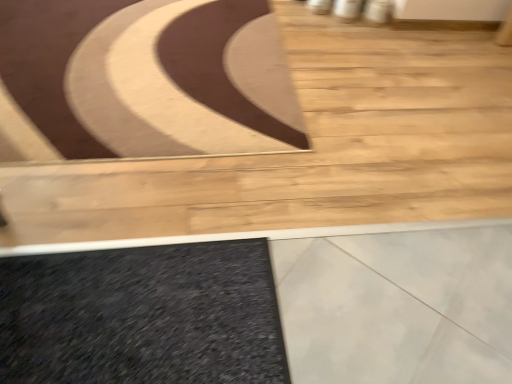
This screenshot has width=512, height=384. Find the location of `granite stairs at center`. granite stairs at center is located at coordinates (313, 151).

Describe the element at coordinates (313, 151) in the screenshot. I see `granite stairs at center` at that location.

Measure the distance between point [162,210] and camera.

Point [162,210] is 1.45 meters away from camera.

This screenshot has height=384, width=512. Identify the location of granite stairs at center. (313, 151).